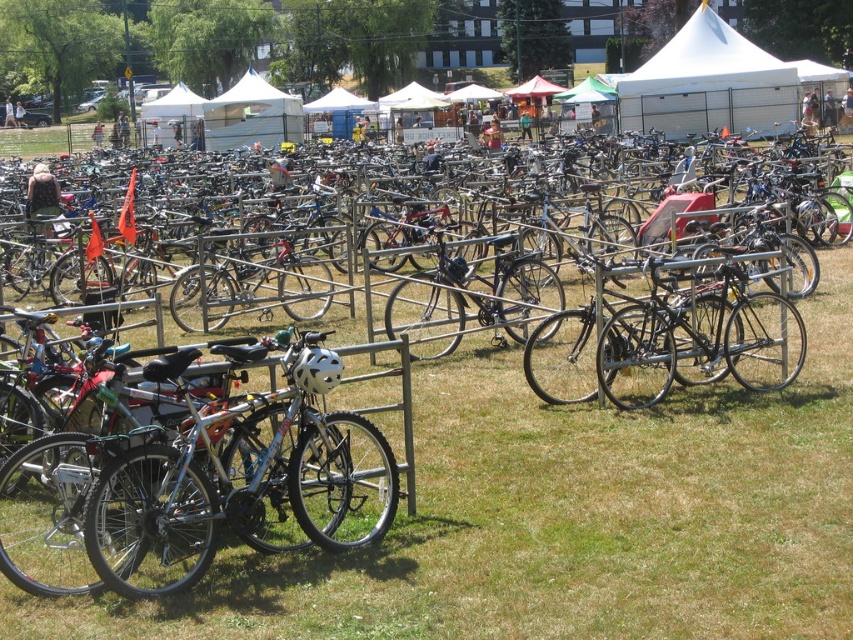
Question: Among these objects, which one is nearest to the camera?

Choices:
 (A) white fabric tent at center
 (B) white canvas tent at upper right

Answer: (B)

Question: Which point is closer to the camera taking this photo?

Choices:
 (A) (819, 332)
 (B) (262, 467)
 (C) (773, 70)
 (D) (259, 138)

Answer: (B)

Question: Is silver metallic bicycle at center wider than shiny silver bicycle at center?

Choices:
 (A) yes
 (B) no

Answer: (B)

Question: Estimate the real-world distances between objects in this image. Which object is farther from the shiny silver bicycle at center?

Choices:
 (A) white canvas tent at upper right
 (B) silver metallic bicycle at center
 (C) white fabric tent at center

Answer: (C)

Question: Is shiny silver bicycle at center to the left of white canvas tent at upper right from the viewer's perspective?

Choices:
 (A) yes
 (B) no

Answer: (A)

Question: Does white canvas tent at upper right appear over white fabric tent at center?

Choices:
 (A) no
 (B) yes

Answer: (A)